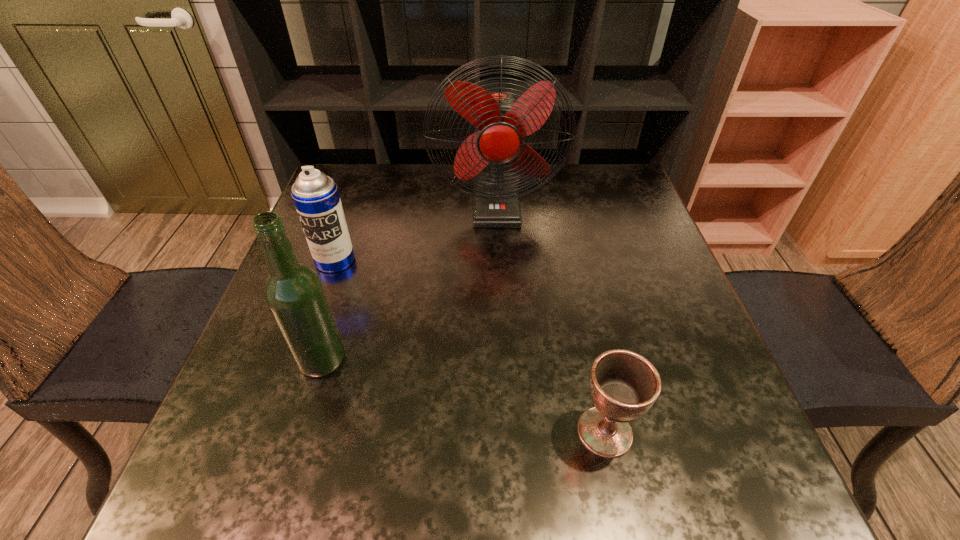
Find the location of a particular element. the farthest object is located at coordinates (502, 120).

At what (x,y) coordinates should I click in order to perform the action: click on fan. Please return your answer as a coordinate pair (x, y). Looking at the image, I should click on (502, 120).

Identify the location of liquor. Image resolution: width=960 pixels, height=540 pixels. (294, 293).

At what (x,y) coordinates should I click in order to perform the action: click on the second nearest object. Please return your answer as a coordinate pair (x, y). Looking at the image, I should click on (294, 293).

Where is `the third nearest object`? The height and width of the screenshot is (540, 960). the third nearest object is located at coordinates (315, 195).

At what (x,y) coordinates should I click in order to perform the action: click on the third tallest object. Please return your answer as a coordinate pair (x, y). The image size is (960, 540). Looking at the image, I should click on (315, 195).

This screenshot has width=960, height=540. In order to click on the nearest object in this screenshot , I will do `click(624, 385)`.

Where is `the shortest object`? This screenshot has height=540, width=960. the shortest object is located at coordinates (624, 385).

Locate an element on the screen. vacant space positioned on the front-facing side of the fan is located at coordinates (500, 287).

At what (x,y) coordinates should I click in order to perform the action: click on vacant space located 0.230m on the back of the liquor. Please return your answer as a coordinate pair (x, y). Image resolution: width=960 pixels, height=540 pixels. Looking at the image, I should click on (352, 262).